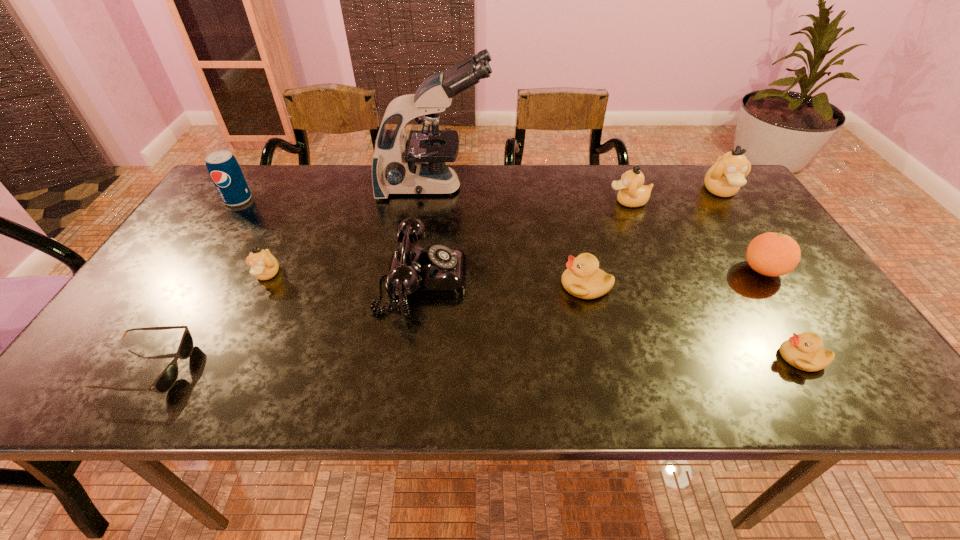
Where is `the tallest object`? This screenshot has height=540, width=960. the tallest object is located at coordinates (416, 165).

Where is `the rightmost tan duckling`? This screenshot has height=540, width=960. the rightmost tan duckling is located at coordinates (724, 179).

This screenshot has height=540, width=960. Identify the location of the biggest tan duckling. (724, 179).

The width and height of the screenshot is (960, 540). In order to click on blue pop in this screenshot , I will do `click(225, 172)`.

You are a GUI agent. You are given a task and a screenshot of the screen. Output one action in this format:
    pyautogui.click(x=<x>, y=<y>)
    Task: Click on the black telephone
    
    Given the screenshot: What is the action you would take?
    pyautogui.click(x=437, y=272)

Find the location of a particular element. The image size is (960, 540). the second biggest tan duckling is located at coordinates (632, 193).

Where is `the third duckling from right to left`? the third duckling from right to left is located at coordinates (632, 193).

At what (x,y) coordinates should I click in order to perform the action: click on orange. Please return your answer as a coordinate pair (x, y). This screenshot has height=540, width=960. Looking at the image, I should click on (772, 254).

The height and width of the screenshot is (540, 960). Find the location of `the left yellow duckling`. the left yellow duckling is located at coordinates (583, 279).

Locate an element on the screen. Image resolution: width=960 pixels, height=540 pixels. the farther yellow duckling is located at coordinates (583, 279).